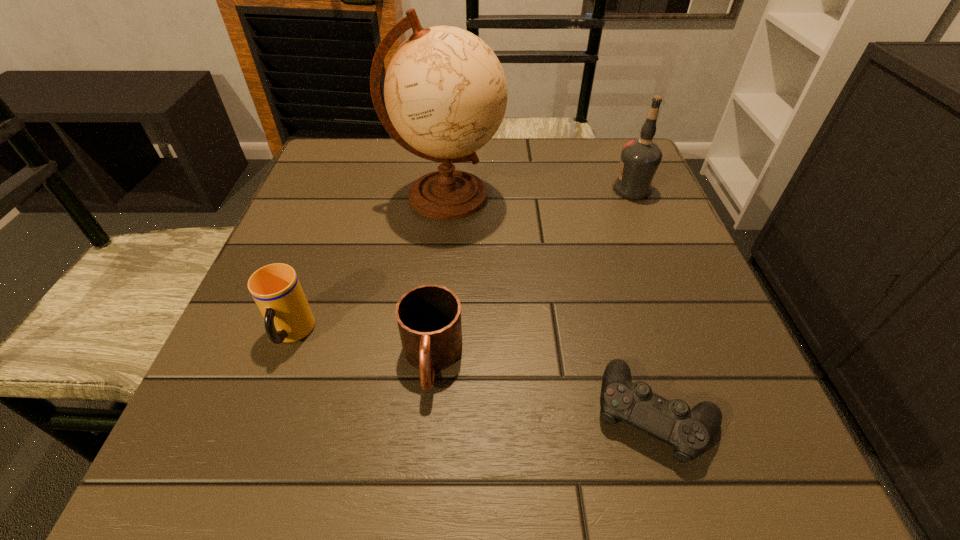
Locate an element on the screen. This screenshot has height=540, width=960. free region that satisfies the following two spatial constraints: 1. on the front label of the fourth shortest object; 2. on the side of the fourth tallest object with the handle is located at coordinates (702, 360).

Identify the location of vacant space that satisfies the following two spatial constraints: 1. on the front label of the fourth shortest object; 2. on the side of the mug with the handle. (702, 360).

This screenshot has width=960, height=540. I want to click on free space that satisfies the following two spatial constraints: 1. on the surface of the tallest object; 2. on the side of the cup with the handle, so click(434, 334).

In order to click on free space that satisfies the following two spatial constraints: 1. on the side of the mug with the handle; 2. on the right side of the control in this screenshot , I will do 427,414.

The image size is (960, 540). What are the coordinates of `vacant space that satisfies the following two spatial constraints: 1. on the back side of the shortest object; 2. on the surface of the tallest object` in the screenshot? It's located at (590, 196).

Identify the location of free space in the image that satisfies the following two spatial constraints: 1. on the back side of the control; 2. on the surface of the tallest object. 590,196.

You are a GUI agent. You are given a task and a screenshot of the screen. Output one action in this format:
    pyautogui.click(x=<x>, y=<y>)
    Task: Click on the vacant region that satisfies the following two spatial constraints: 1. on the surface of the tallest object; 2. on the side of the third shortest object with the handle
    This screenshot has width=960, height=540.
    Given the screenshot: What is the action you would take?
    pyautogui.click(x=434, y=334)